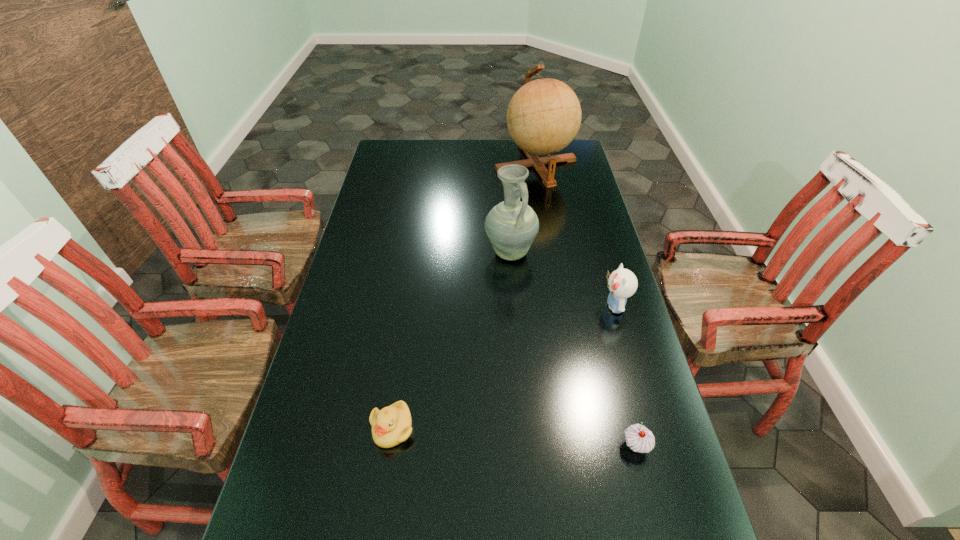
The image size is (960, 540). I want to click on globe, so click(543, 117).

Image resolution: width=960 pixels, height=540 pixels. Find the location of `the farthest object`. the farthest object is located at coordinates 543,117.

You are a GUI agent. You are given a task and a screenshot of the screen. Output one action in this format:
    pyautogui.click(x=<x>, y=<y>)
    Task: Click on the pitcher
    
    Given the screenshot: What is the action you would take?
    pyautogui.click(x=512, y=225)

Locate an element on the screen. The width and height of the screenshot is (960, 540). the fourth nearest object is located at coordinates (512, 225).

This screenshot has width=960, height=540. What are the coordinates of `the third nearest object` in the screenshot? It's located at (622, 283).

Locate an element on the screen. kitten is located at coordinates (622, 283).

Where is `cupcake`? This screenshot has height=540, width=960. cupcake is located at coordinates (638, 438).

Find the location of a particular element. This screenshot has width=960, height=540. the shortest object is located at coordinates (391, 425).

The width and height of the screenshot is (960, 540). In order to click on the leftmost object in this screenshot , I will do `click(391, 425)`.

In order to click on vacant space situated 0.160m on the surface of the farthest object in this screenshot , I will do `click(543, 213)`.